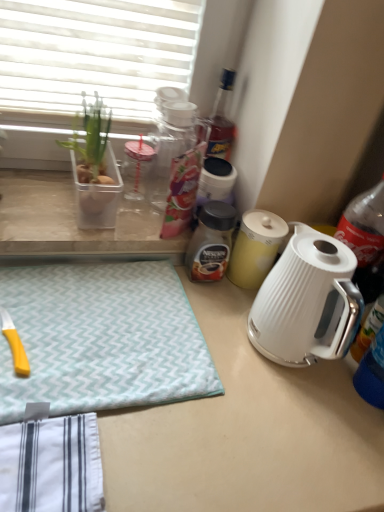
Question: From the image's perspective, is yellow matte canister at center below white glossy electric kettle at center?

Choices:
 (A) no
 (B) yes

Answer: (A)

Question: Considering the relative positions of yellow matte canister at center and white glossy electric kettle at center in the image provided, is yellow matte canister at center to the left of white glossy electric kettle at center from the viewer's perspective?

Choices:
 (A) no
 (B) yes

Answer: (A)

Question: Is yellow matte canister at center further to camera compared to white glossy electric kettle at center?

Choices:
 (A) yes
 (B) no

Answer: (A)

Question: Is white glossy electric kettle at center located within yellow matte canister at center?

Choices:
 (A) yes
 (B) no

Answer: (B)

Question: Considering the relative positions of yellow matte canister at center and white glossy electric kettle at center in the image provided, is yellow matte canister at center in front of white glossy electric kettle at center?

Choices:
 (A) yes
 (B) no

Answer: (B)

Question: Would you consider yellow matte canister at center to be distant from white glossy electric kettle at center?

Choices:
 (A) no
 (B) yes

Answer: (A)

Question: Is brown glass jar at center oriented away from white glossy electric kettle at center?

Choices:
 (A) no
 (B) yes

Answer: (A)

Question: Considering the relative positions of brown glass jar at center and white glossy electric kettle at center in the image provided, is brown glass jar at center in front of white glossy electric kettle at center?

Choices:
 (A) yes
 (B) no

Answer: (B)

Question: From the image's perspective, is brown glass jar at center under white glossy electric kettle at center?

Choices:
 (A) no
 (B) yes

Answer: (A)

Question: Would you say brown glass jar at center is outside white glossy electric kettle at center?

Choices:
 (A) no
 (B) yes

Answer: (B)

Question: Could white glossy electric kettle at center be considered to be inside brown glass jar at center?

Choices:
 (A) yes
 (B) no

Answer: (B)

Question: Does brown glass jar at center have a greater height compared to white glossy electric kettle at center?

Choices:
 (A) no
 (B) yes

Answer: (A)

Question: Is clear plastic container at left positioned with its back to yellow matte canister at center?

Choices:
 (A) no
 (B) yes

Answer: (A)